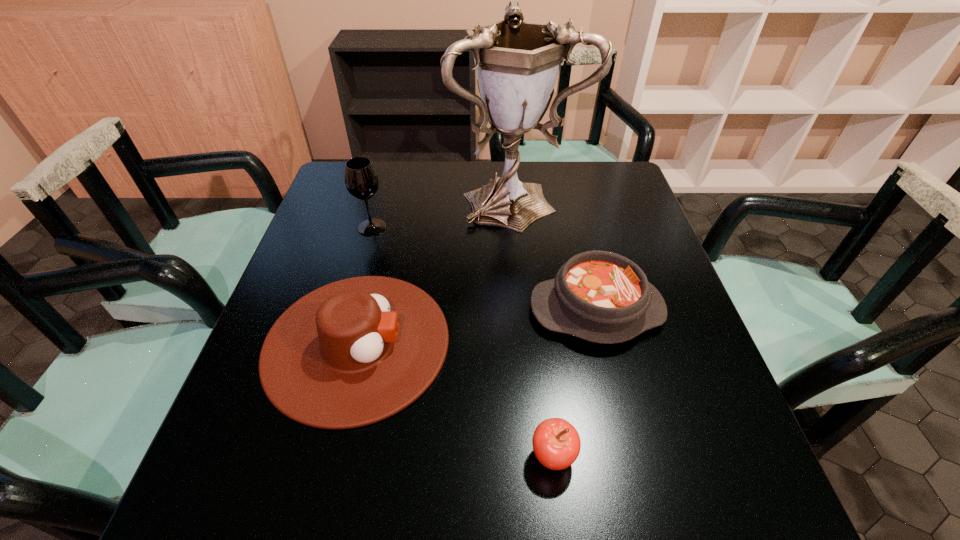
Image resolution: width=960 pixels, height=540 pixels. I want to click on free space between the casserole and the tallest object, so click(555, 253).

Image resolution: width=960 pixels, height=540 pixels. In order to click on free space between the cowboy hat and the casserole in this screenshot , I will do `click(476, 327)`.

In order to click on vacant space that's between the apple and the cowboy hat in this screenshot , I will do `click(455, 400)`.

Image resolution: width=960 pixels, height=540 pixels. I want to click on vacant space that is in between the cowboy hat and the nearest object, so click(x=455, y=400).

Find the location of a particular element. free point between the casserole and the fourth shortest object is located at coordinates (484, 268).

You are a GUI agent. You are given a task and a screenshot of the screen. Output one action in this format:
    pyautogui.click(x=<x>, y=<y>)
    Task: Click on the vacant area that lies between the cowboy hat and the trophy cup
    
    Given the screenshot: What is the action you would take?
    pos(436,270)

You are a GUI agent. You are given a task and a screenshot of the screen. Output one action in this format:
    pyautogui.click(x=<x>, y=<y>)
    Task: Click on the vacant space in between the casserole and the cowboy hat
    
    Given the screenshot: What is the action you would take?
    pyautogui.click(x=476, y=327)

Where is `unoccupied position between the fourth shortest object and the tallest object`? unoccupied position between the fourth shortest object and the tallest object is located at coordinates (443, 212).

Image resolution: width=960 pixels, height=540 pixels. Identify the location of the third closest object relative to the cowboy hat. (517, 63).

The height and width of the screenshot is (540, 960). I want to click on the fourth closest object to the cowboy hat, so click(599, 296).